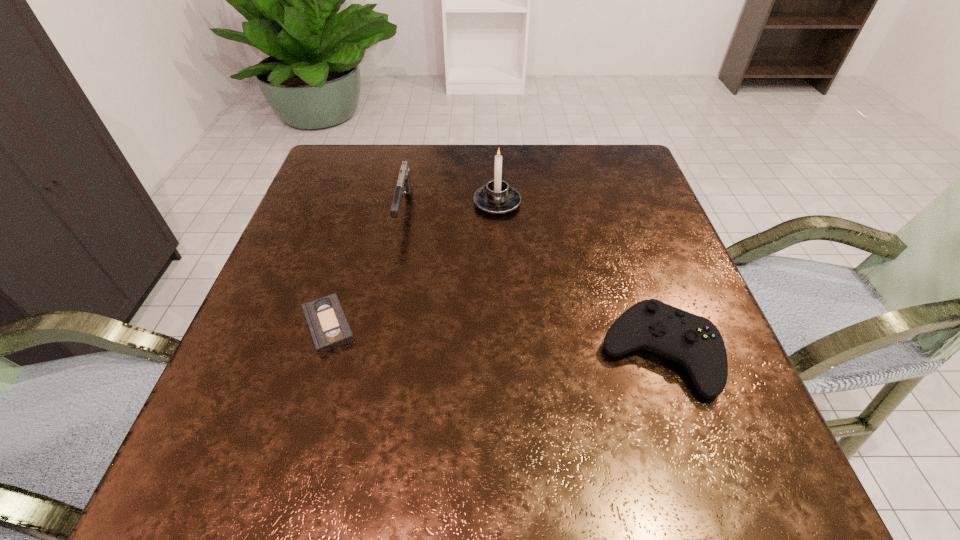
What are the coordinates of `the second object from right to left` in the screenshot? It's located at (497, 197).

Image resolution: width=960 pixels, height=540 pixels. In order to click on the tallest object in this screenshot , I will do `click(497, 197)`.

At what (x,y) coordinates should I click in order to perform the action: click on the third object from right to left. Please return your answer as a coordinate pair (x, y). The height and width of the screenshot is (540, 960). Looking at the image, I should click on (404, 184).

You are a GUI agent. You are given a task and a screenshot of the screen. Output one action in this format:
    pyautogui.click(x=<x>, y=<y>)
    Task: Click on the second tallest object
    
    Given the screenshot: What is the action you would take?
    pyautogui.click(x=404, y=184)

Where is `the third tallest object`? the third tallest object is located at coordinates pos(693,341).

The width and height of the screenshot is (960, 540). I want to click on the rightmost object, so click(693, 341).

Identify the location of the leftmost object. This screenshot has height=540, width=960. (329, 328).

The width and height of the screenshot is (960, 540). Identify the location of videotape. (329, 328).

Where is `free region located with a handle on the side of the tallest object`? free region located with a handle on the side of the tallest object is located at coordinates (502, 323).

Identify the location of free space located at the muzzle end of the third shortest object. The image size is (960, 540). (384, 313).